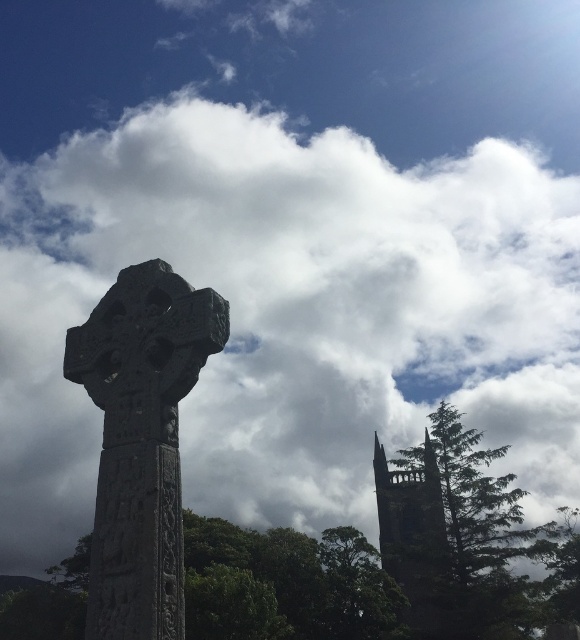
Question: Which point appears closest to the camera in this image?

Choices:
 (A) (397, 465)
 (B) (396, 540)

Answer: (A)

Question: Can you confirm if green textured tree at center is smaller than dark gray stone tower at right?

Choices:
 (A) no
 (B) yes

Answer: (A)

Question: Which of the following is the farthest from the observer?

Choices:
 (A) green textured tree at center
 (B) dark gray stone tower at right

Answer: (B)

Question: Which point appears farthest from the camera in this image?

Choices:
 (A) (404, 504)
 (B) (263, 577)

Answer: (A)

Question: Is green textured tree at center above dark gray stone tower at right?

Choices:
 (A) no
 (B) yes

Answer: (A)

Question: Is green textured tree at center below dark gray stone tower at right?

Choices:
 (A) no
 (B) yes

Answer: (B)